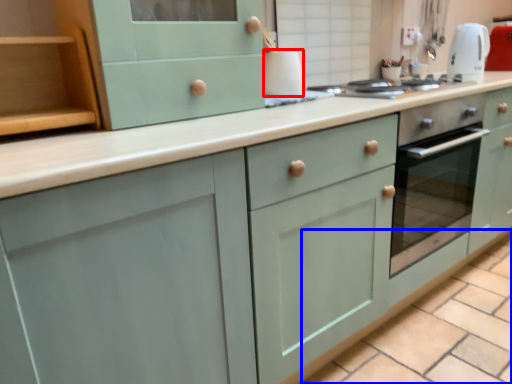
Question: Among these objects, which one is nearest to the camera, appliance (highlighted by a red box) or tile (highlighted by a blue box)?

Choices:
 (A) appliance
 (B) tile

Answer: (B)